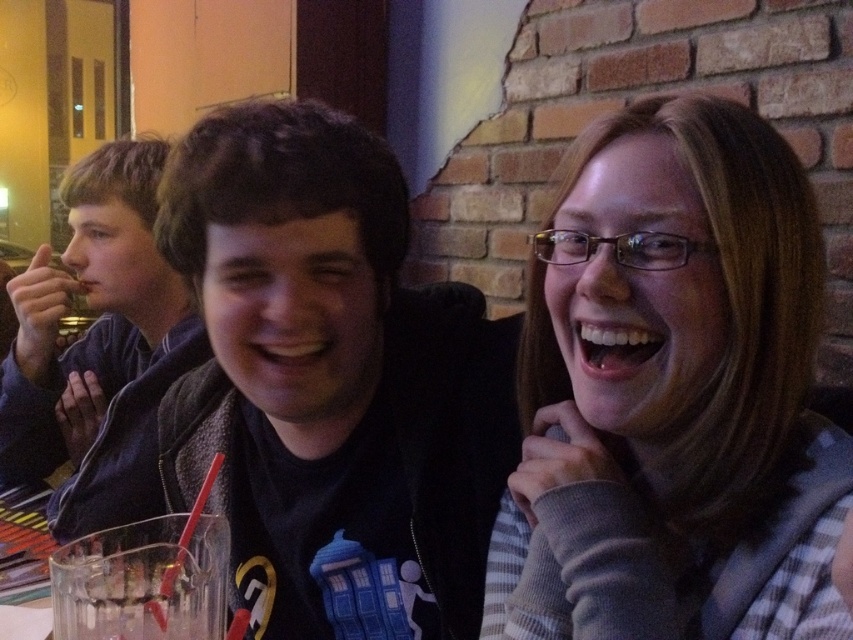
Question: Considering the real-world distances, which object is closest to the plaid shirt at center?

Choices:
 (A) black matte jacket at center
 (B) clear glass cup at lower left

Answer: (A)

Question: Is plaid shirt at center smaller than black matte jacket at center?

Choices:
 (A) no
 (B) yes

Answer: (B)

Question: Can you confirm if black matte jacket at center is bigger than dark blue jacket at left?

Choices:
 (A) yes
 (B) no

Answer: (B)

Question: Which object appears closest to the camera in this image?

Choices:
 (A) dark blue jacket at left
 (B) black matte jacket at center
 (C) plaid shirt at center
 (D) clear glass cup at lower left

Answer: (C)

Question: Estimate the real-world distances between objects in this image. Which object is farther from the black matte jacket at center?

Choices:
 (A) clear glass cup at lower left
 (B) plaid shirt at center
 (C) dark blue jacket at left

Answer: (C)

Question: Where is plaid shirt at center located in relation to clear glass cup at lower left in the image?

Choices:
 (A) left
 (B) right

Answer: (B)